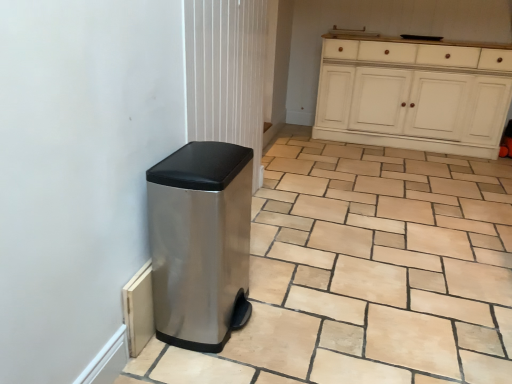
The height and width of the screenshot is (384, 512). Describe the element at coordinates (366, 272) in the screenshot. I see `beige stone tile at lower center` at that location.

Where is `white painted wood cabinet at upper right`? white painted wood cabinet at upper right is located at coordinates (414, 95).

In order to click on cabinetry on the right of beige stone tile at lower center in this screenshot , I will do `click(414, 95)`.

Is white painted wood cabinet at upper right next to beige stone tile at lower center and touching it?

No, white painted wood cabinet at upper right is not in contact with beige stone tile at lower center.

Is point (417, 52) closer or farther from the camera than point (339, 258)?

Point (417, 52) is positioned farther from the camera compared to point (339, 258).

Can you confirm if polished stainless steel trash can at lower left is bigger than white painted wood cabinet at upper right?

No.

Is polished stainless steel trash can at lower left further to the viewer compared to white painted wood cabinet at upper right?

No, polished stainless steel trash can at lower left is closer to the camera.

Is polished stainless steel trash can at lower left completely or partially outside of white painted wood cabinet at upper right?

Yes.

Identify the location of ceramic tile that is under the polished stainless steel trash can at lower left (from a real-world perspective). The image size is (512, 384). (366, 272).

Is polished stainless steel trash can at lower left positioned with its back to beige stone tile at lower center?

No.

Considering the relative sizes of polished stainless steel trash can at lower left and beige stone tile at lower center in the image provided, is polished stainless steel trash can at lower left shorter than beige stone tile at lower center?

In fact, polished stainless steel trash can at lower left may be taller than beige stone tile at lower center.

Which object is thinner, polished stainless steel trash can at lower left or beige stone tile at lower center?

polished stainless steel trash can at lower left is thinner.

Considering the relative sizes of beige stone tile at lower center and white painted wood cabinet at upper right in the image provided, is beige stone tile at lower center bigger than white painted wood cabinet at upper right?

Actually, beige stone tile at lower center might be smaller than white painted wood cabinet at upper right.

Could you tell me if beige stone tile at lower center is facing white painted wood cabinet at upper right?

Yes, beige stone tile at lower center is oriented towards white painted wood cabinet at upper right.

Is beige stone tile at lower center next to white painted wood cabinet at upper right and touching it?

No.

Can you tell me how much beige stone tile at lower center and white painted wood cabinet at upper right differ in facing direction?

The angle between the facing direction of beige stone tile at lower center and the facing direction of white painted wood cabinet at upper right is 180 degrees.

Is beige stone tile at lower center in front of or behind polished stainless steel trash can at lower left in the image?

beige stone tile at lower center is positioned closer to the viewer than polished stainless steel trash can at lower left.

Consider the image. Considering the sizes of beige stone tile at lower center and polished stainless steel trash can at lower left in the image, is beige stone tile at lower center taller or shorter than polished stainless steel trash can at lower left?

Clearly, beige stone tile at lower center is shorter compared to polished stainless steel trash can at lower left.

Find the location of a particular element. This screenshot has width=512, height=384. ceramic tile that is above the polished stainless steel trash can at lower left (from the image's perspective) is located at coordinates (366, 272).

From a real-world perspective, is beige stone tile at lower center above or below polished stainless steel trash can at lower left?

beige stone tile at lower center is situated lower than polished stainless steel trash can at lower left in the real world.

Which object is thinner, white painted wood cabinet at upper right or polished stainless steel trash can at lower left?

Thinner between the two is polished stainless steel trash can at lower left.

Looking at this image, is white painted wood cabinet at upper right taller or shorter than polished stainless steel trash can at lower left?

In the image, white painted wood cabinet at upper right appears to be taller than polished stainless steel trash can at lower left.

Is point (422, 71) positioned after point (225, 256)?

Yes, point (422, 71) is behind point (225, 256).

You are a GUI agent. You are given a task and a screenshot of the screen. Output one action in this format:
    pyautogui.click(x=<x>, y=<y>)
    Task: Click on the cabinetry that is behind the beige stone tile at lower center
    This screenshot has height=384, width=512.
    Given the screenshot: What is the action you would take?
    pyautogui.click(x=414, y=95)

Where is `cabinetry lying above the polished stainless steel trash can at lower left (from the image's perspective)`? The width and height of the screenshot is (512, 384). cabinetry lying above the polished stainless steel trash can at lower left (from the image's perspective) is located at coordinates (414, 95).

Looking at this image, considering their positions, is white painted wood cabinet at upper right positioned closer to polished stainless steel trash can at lower left than beige stone tile at lower center?

beige stone tile at lower center.

Estimate the real-world distances between objects in this image. Which object is closer to white painted wood cabinet at upper right, beige stone tile at lower center or polished stainless steel trash can at lower left?

Among the two, beige stone tile at lower center is located nearer to white painted wood cabinet at upper right.

Estimate the real-world distances between objects in this image. Which object is closer to beige stone tile at lower center, polished stainless steel trash can at lower left or white painted wood cabinet at upper right?

The object closer to beige stone tile at lower center is polished stainless steel trash can at lower left.

Looking at the image, which one is located closer to white painted wood cabinet at upper right, polished stainless steel trash can at lower left or beige stone tile at lower center?

beige stone tile at lower center is closer to white painted wood cabinet at upper right.

Based on their spatial positions, is white painted wood cabinet at upper right or polished stainless steel trash can at lower left further from beige stone tile at lower center?

white painted wood cabinet at upper right is further to beige stone tile at lower center.

Estimate the real-world distances between objects in this image. Which object is further from polished stainless steel trash can at lower left, beige stone tile at lower center or white painted wood cabinet at upper right?

white painted wood cabinet at upper right lies further to polished stainless steel trash can at lower left than the other object.

The height and width of the screenshot is (384, 512). Find the location of `waste container between beige stone tile at lower center and white painted wood cabinet at upper right along the z-axis`. waste container between beige stone tile at lower center and white painted wood cabinet at upper right along the z-axis is located at coordinates (199, 241).